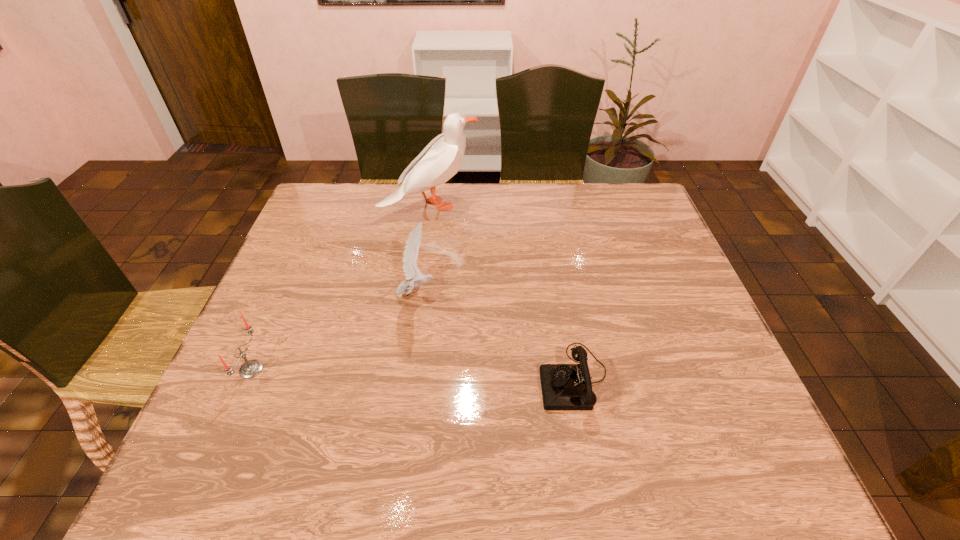
Find the location of `the tallest object`. the tallest object is located at coordinates (440, 160).

Locate an element on the screen. the taller gull is located at coordinates (440, 160).

Find the location of a particular element. This screenshot has width=960, height=540. the second farthest object is located at coordinates (410, 255).

This screenshot has width=960, height=540. I want to click on the nearer gull, so click(x=410, y=255).

Identify the location of candle. Image resolution: width=960 pixels, height=540 pixels. (251, 368).

Locate an element on the screen. This screenshot has height=540, width=960. the rightmost object is located at coordinates (568, 387).

At what (x,y) coordinates should I click in order to perform the action: click on the shortest object. Please return your answer as a coordinate pair (x, y). This screenshot has height=540, width=960. Looking at the image, I should click on (568, 387).

The width and height of the screenshot is (960, 540). I want to click on vacant space situated at the beak of the tallest object, so click(x=533, y=205).

Where is `vacant space situated at the tip of the beak of the second farthest object`? The height and width of the screenshot is (540, 960). vacant space situated at the tip of the beak of the second farthest object is located at coordinates (583, 294).

The height and width of the screenshot is (540, 960). What are the coordinates of `vacant region located 0.340m on the front-facing side of the candle` in the screenshot? It's located at (414, 369).